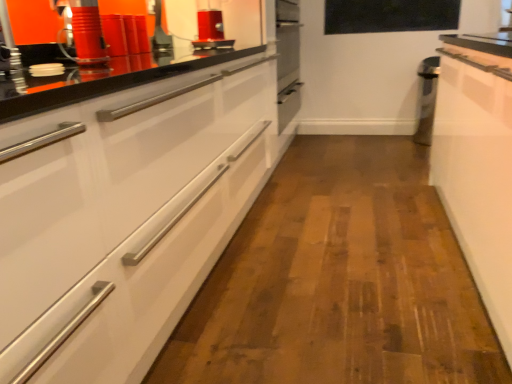
Question: Would you say shiny red toaster at upper center, the 1th appliance in the back-to-front sequence, is to the left or to the right of matte red canister at upper left, which is counted as the 2th appliance, starting from the back, in the picture?

Choices:
 (A) right
 (B) left

Answer: (A)

Question: Is point (204, 48) positioned closer to the camera than point (70, 3)?

Choices:
 (A) closer
 (B) farther

Answer: (B)

Question: Based on their relative distances, which object is farther from the black glass window screen at upper center?

Choices:
 (A) white glossy cabinet at left
 (B) white glossy cabinet at right
 (C) matte red canister at upper left, placed as the 2th appliance when sorted from top to bottom
 (D) shiny red toaster at upper center, placed as the first appliance when sorted from right to left

Answer: (C)

Question: Which object is positioned farthest from the shiny red toaster at upper center, the 1th appliance viewed from the top?

Choices:
 (A) matte red canister at upper left, which is the first appliance in front-to-back order
 (B) white glossy cabinet at left
 (C) white glossy cabinet at right
 (D) black glass window screen at upper center

Answer: (D)